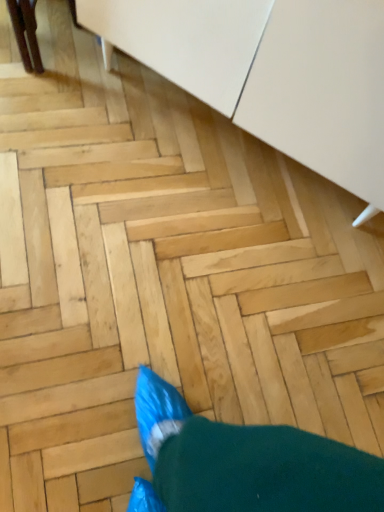
In order to face natural wood cabinet at center, should I rotate leftwards or rightwards?

You should look right and rotate roughly 12.391 degrees.

The width and height of the screenshot is (384, 512). What do you see at coordinates (271, 72) in the screenshot? I see `natural wood cabinet at center` at bounding box center [271, 72].

The height and width of the screenshot is (512, 384). What are the coordinates of `natural wood cabinet at center` in the screenshot? It's located at (271, 72).

Measure the distance between natural wood cabinet at center and camera.

27.66 inches.

Locate an element on the screen. The height and width of the screenshot is (512, 384). natural wood cabinet at center is located at coordinates (x=271, y=72).